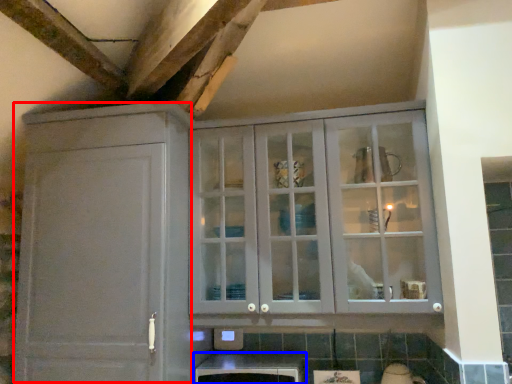
Question: Which object is further to the camera taking this photo, cabinetry (highlighted by a red box) or cabinetry (highlighted by a blue box)?

Choices:
 (A) cabinetry
 (B) cabinetry

Answer: (B)